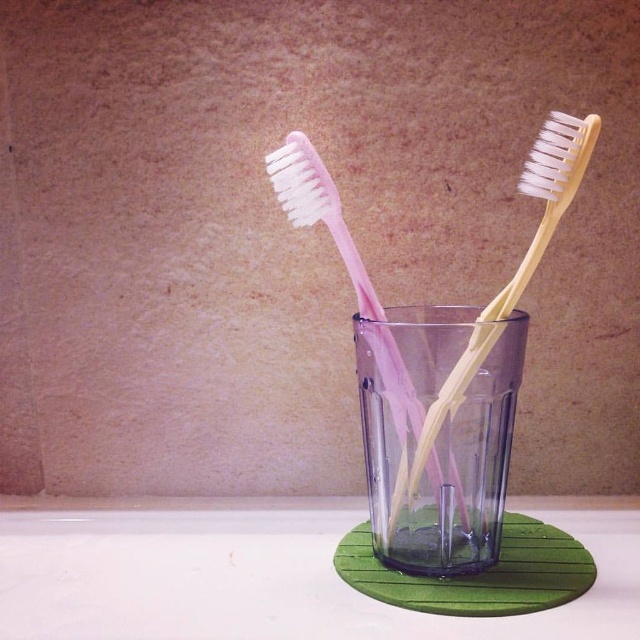
Who is taller, transparent plastic cup at center or pink plastic toothbrush at center?

pink plastic toothbrush at center

The height and width of the screenshot is (640, 640). What are the coordinates of `transparent plastic cup at center` in the screenshot? It's located at (444, 464).

Is point (477, 401) in front of point (396, 432)?

Yes.

Locate an element on the screen. transparent plastic cup at center is located at coordinates (444, 464).

Does yellow matte toothbrush at center have a greater width compared to pink plastic toothbrush at center?

No, yellow matte toothbrush at center is not wider than pink plastic toothbrush at center.

Is point (563, 144) farther from viewer compared to point (424, 410)?

No.

Does point (566, 163) come behind point (371, 326)?

That is False.

Identify the location of yellow matte toothbrush at center. (508, 282).

Who is more forward, [387,532] or [435,435]?

Positioned in front is point [435,435].

Between transparent plastic cup at center and yellow matte toothbrush at center, which one is positioned lower?

transparent plastic cup at center is lower down.

At what (x,y) coordinates should I click in order to perform the action: click on transparent plastic cup at center. Please return your answer as a coordinate pair (x, y). Looking at the image, I should click on (444, 464).

Locate an element on the screen. transparent plastic cup at center is located at coordinates (444, 464).